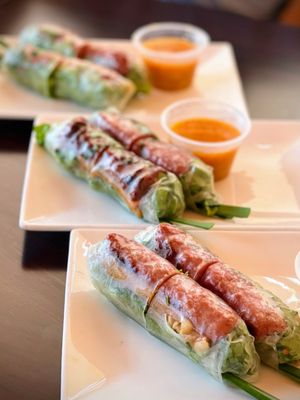
Where is `tables`? The width and height of the screenshot is (300, 400). tables is located at coordinates (267, 66), (10, 184).